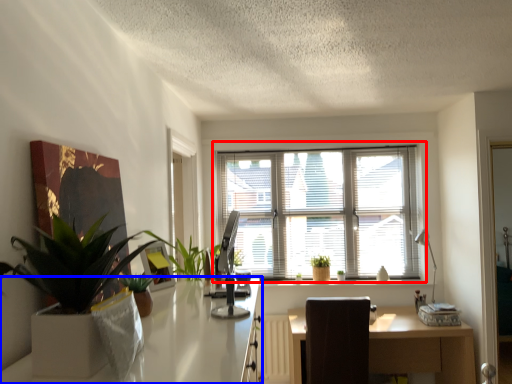
Question: Which point is further to the camera, window (highlighted by a red box) or desk (highlighted by a blue box)?

Choices:
 (A) window
 (B) desk

Answer: (A)